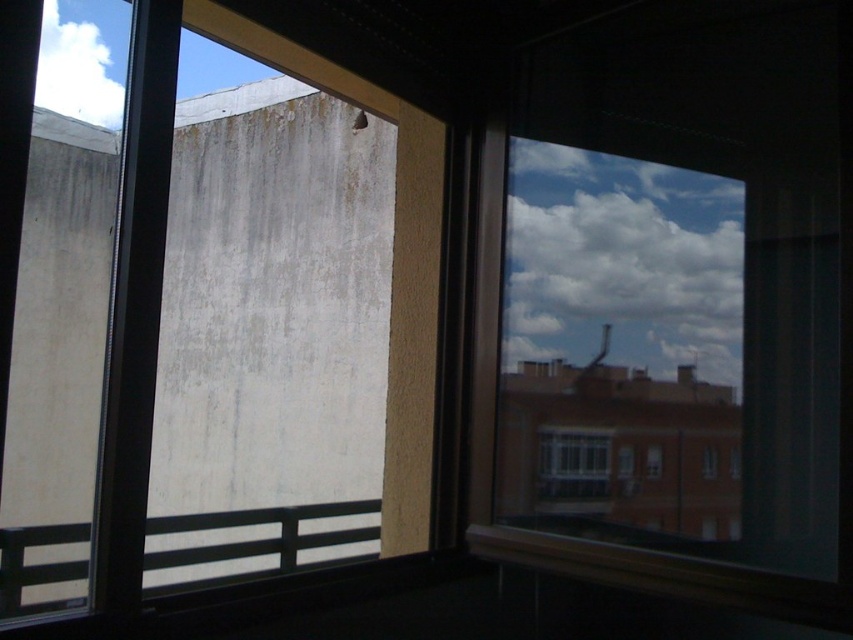
Looking at this image, is transparent glass window at upper right shorter than clear glass window at center?

No, transparent glass window at upper right is not shorter than clear glass window at center.

Which is above, transparent glass window at upper right or clear glass window at center?

Positioned higher is transparent glass window at upper right.

The image size is (853, 640). Find the location of `transparent glass window at upper right`. transparent glass window at upper right is located at coordinates (670, 356).

Find the location of a particular element. The image size is (853, 640). transparent glass window at upper right is located at coordinates (670, 356).